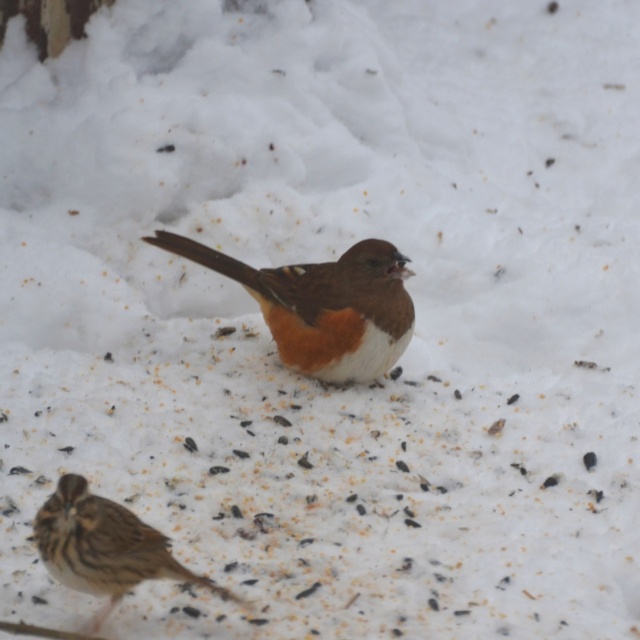
Question: In this image, where is brown feathered sparrow at center located relative to brown speckled sparrow at lower left?

Choices:
 (A) below
 (B) above

Answer: (B)

Question: Is brown feathered sparrow at center thinner than brown speckled sparrow at lower left?

Choices:
 (A) no
 (B) yes

Answer: (A)

Question: Which object appears closest to the camera in this image?

Choices:
 (A) brown speckled sparrow at lower left
 (B) brown feathered sparrow at center

Answer: (A)

Question: Is brown feathered sparrow at center wider than brown speckled sparrow at lower left?

Choices:
 (A) no
 (B) yes

Answer: (B)

Question: Which point is closer to the camera?

Choices:
 (A) brown feathered sparrow at center
 (B) brown speckled sparrow at lower left

Answer: (B)